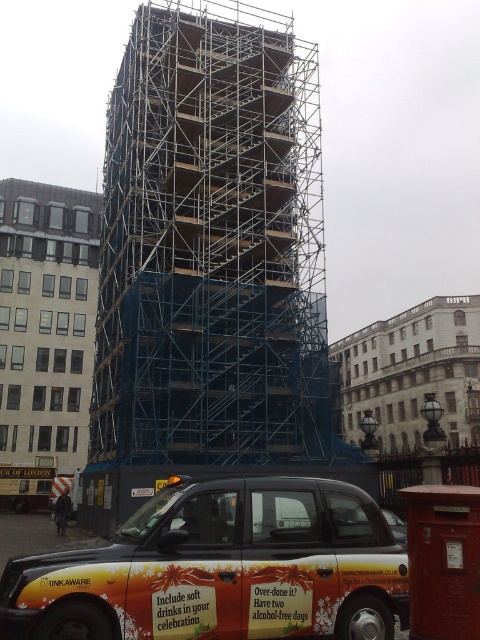
Question: Does blue metallic scaffolding at center appear under orange painted taxi at lower center?

Choices:
 (A) yes
 (B) no

Answer: (B)

Question: From the image, what is the correct spatial relationship of blue metallic scaffolding at center in relation to orange painted taxi at lower center?

Choices:
 (A) left
 (B) right

Answer: (A)

Question: Which point appears farthest from the camera in this image?

Choices:
 (A) (218, 572)
 (B) (216, 433)

Answer: (B)

Question: Is blue metallic scaffolding at center wider than orange painted taxi at lower center?

Choices:
 (A) yes
 (B) no

Answer: (A)

Question: Which of the following is the closest to the observer?

Choices:
 (A) blue metallic scaffolding at center
 (B) orange painted taxi at lower center

Answer: (B)